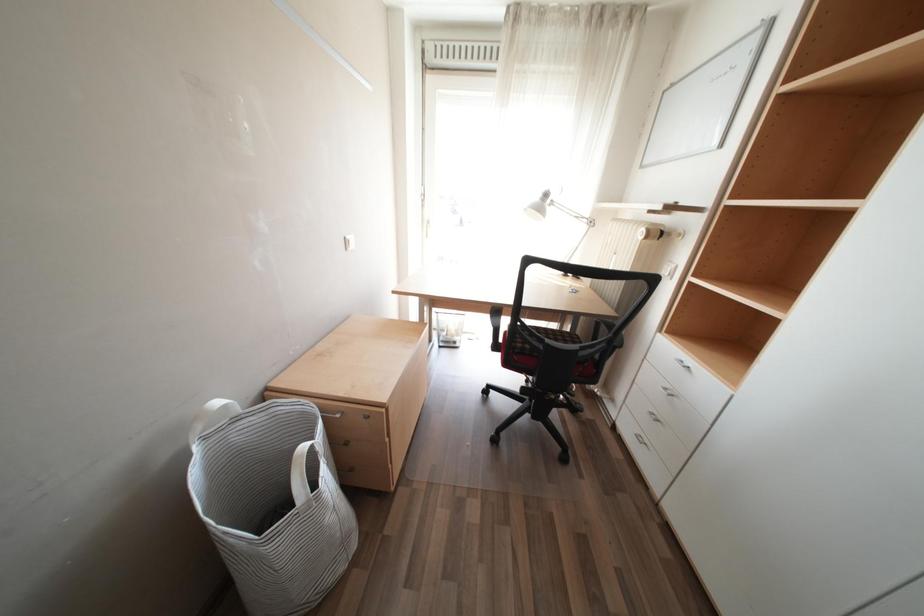
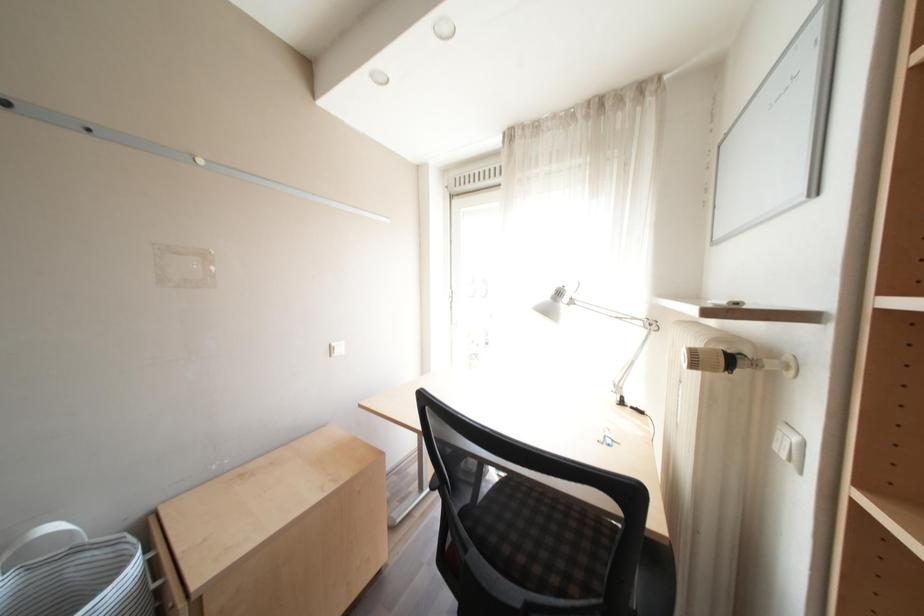
Based on the continuous images, in which direction is the camera rotating?

The rotation direction of the camera is left-up.